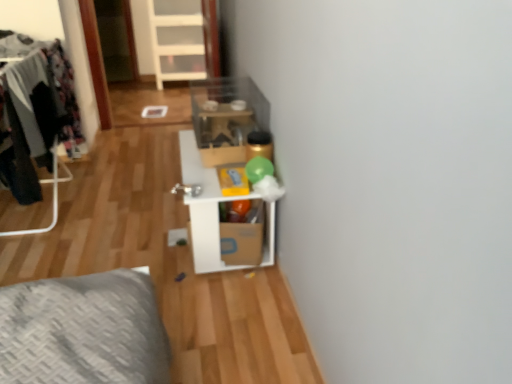
Question: Does dark gray fabric clothes at left have a lesser width compared to cardboard box at center?

Choices:
 (A) no
 (B) yes

Answer: (B)

Question: Is dark gray fabric clothes at left to the right of cardboard box at center from the viewer's perspective?

Choices:
 (A) no
 (B) yes

Answer: (A)

Question: Are dark gray fabric clothes at left and cardboard box at center located far from each other?

Choices:
 (A) yes
 (B) no

Answer: (A)

Question: From the image's perspective, would you say dark gray fabric clothes at left is shown under cardboard box at center?

Choices:
 (A) no
 (B) yes

Answer: (A)

Question: From the image's perspective, would you say dark gray fabric clothes at left is positioned over cardboard box at center?

Choices:
 (A) yes
 (B) no

Answer: (A)

Question: Considering their positions, is dark gray fabric clothes at left located in front of or behind white cardboard shelf at center?

Choices:
 (A) behind
 (B) front

Answer: (A)

Question: From a real-world perspective, is dark gray fabric clothes at left positioned above or below white cardboard shelf at center?

Choices:
 (A) above
 (B) below

Answer: (A)

Question: Would you say dark gray fabric clothes at left is to the left or to the right of white cardboard shelf at center in the picture?

Choices:
 (A) right
 (B) left

Answer: (B)

Question: Is dark gray fabric clothes at left spatially inside white cardboard shelf at center, or outside of it?

Choices:
 (A) outside
 (B) inside

Answer: (A)

Question: From a real-world perspective, is cardboard box at center physically located above or below dark gray fabric clothes at left?

Choices:
 (A) below
 (B) above

Answer: (A)

Question: Relative to dark gray fabric clothes at left, is cardboard box at center in front or behind?

Choices:
 (A) behind
 (B) front

Answer: (A)

Question: Is point (246, 240) positioned closer to the camera than point (64, 125)?

Choices:
 (A) farther
 (B) closer

Answer: (B)

Question: From their relative heights in the image, would you say cardboard box at center is taller or shorter than dark gray fabric clothes at left?

Choices:
 (A) tall
 (B) short

Answer: (B)

Question: Considering the relative positions of dark gray fabric clothes at left and cardboard box at center in the image provided, is dark gray fabric clothes at left to the left or to the right of cardboard box at center?

Choices:
 (A) left
 (B) right

Answer: (A)

Question: Is dark gray fabric clothes at left wider or thinner than cardboard box at center?

Choices:
 (A) thin
 (B) wide

Answer: (A)